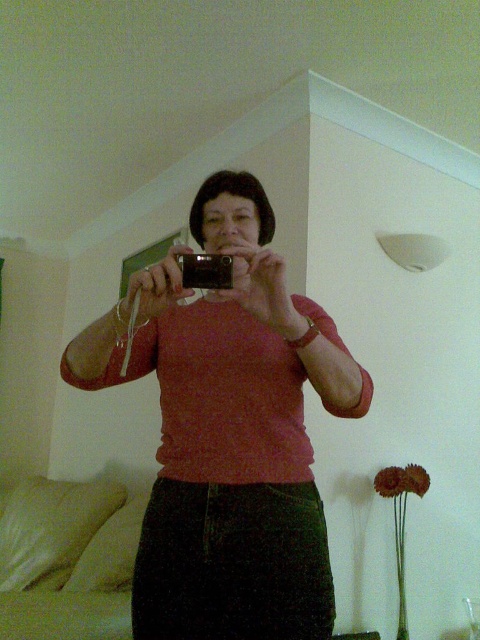
Question: In this image, where is matte pink sweater at center located relative to black plastic camera at center?

Choices:
 (A) below
 (B) above

Answer: (A)

Question: Is matte pink sweater at center positioned at the back of black plastic camera at center?

Choices:
 (A) yes
 (B) no

Answer: (B)

Question: Can you confirm if matte pink sweater at center is thinner than black plastic camera at center?

Choices:
 (A) no
 (B) yes

Answer: (A)

Question: Which of the following is the farthest from the observer?

Choices:
 (A) (187, 284)
 (B) (268, 253)

Answer: (A)

Question: Which point appears farthest from the camera in this image?

Choices:
 (A) (184, 275)
 (B) (272, 589)

Answer: (B)

Question: Which point is farther from the camera taking this photo?

Choices:
 (A) [222, 476]
 (B) [195, 273]

Answer: (A)